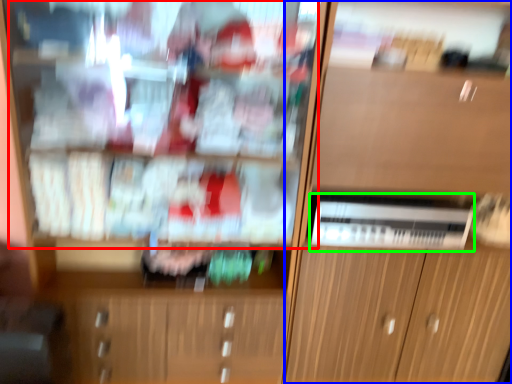
Question: Considering the real-world distances, which object is closest to shelf (highlighted by a red box)? cabinetry (highlighted by a blue box) or appliance (highlighted by a green box).

Choices:
 (A) cabinetry
 (B) appliance

Answer: (A)